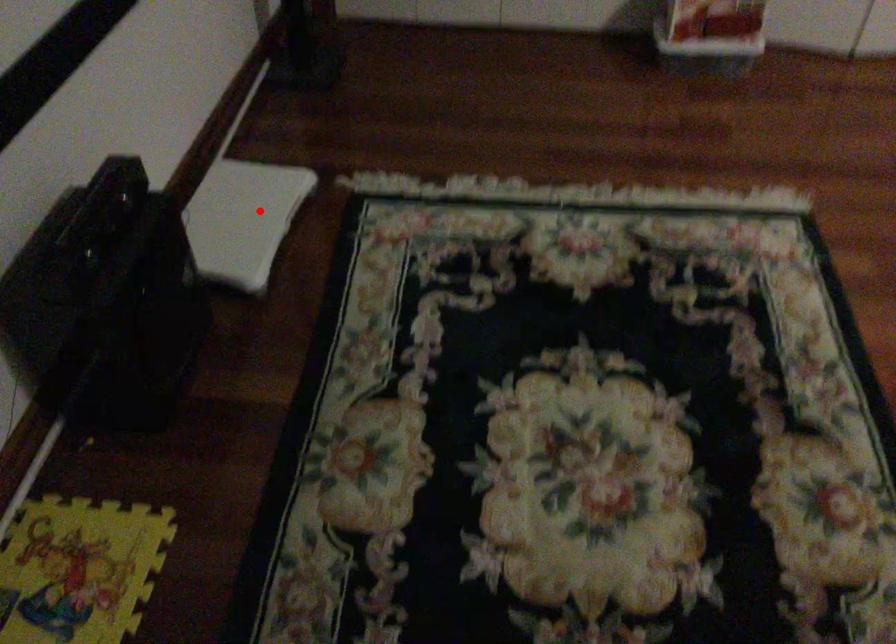
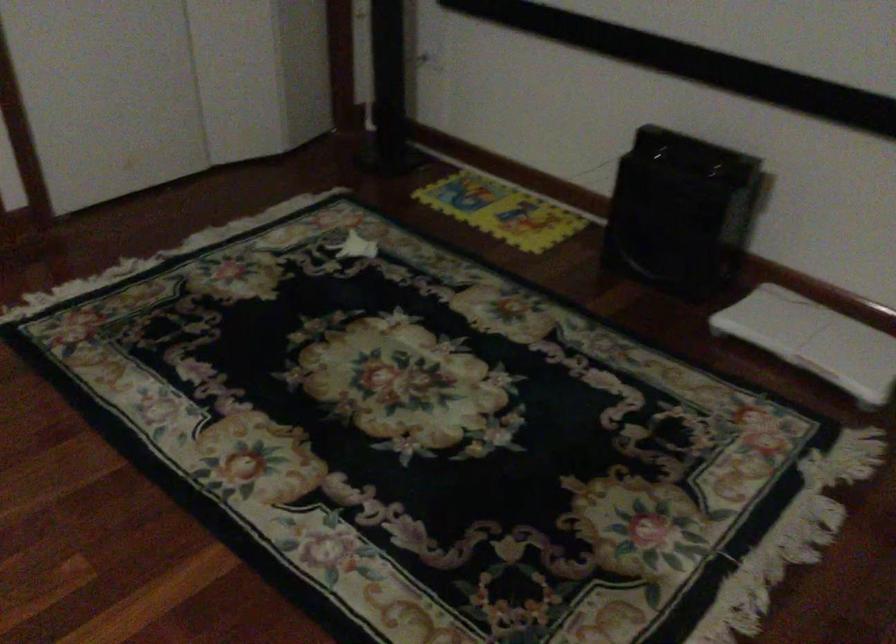
In the second image, find the point that corresponds to the highlighted location in the first image.

(814, 339)